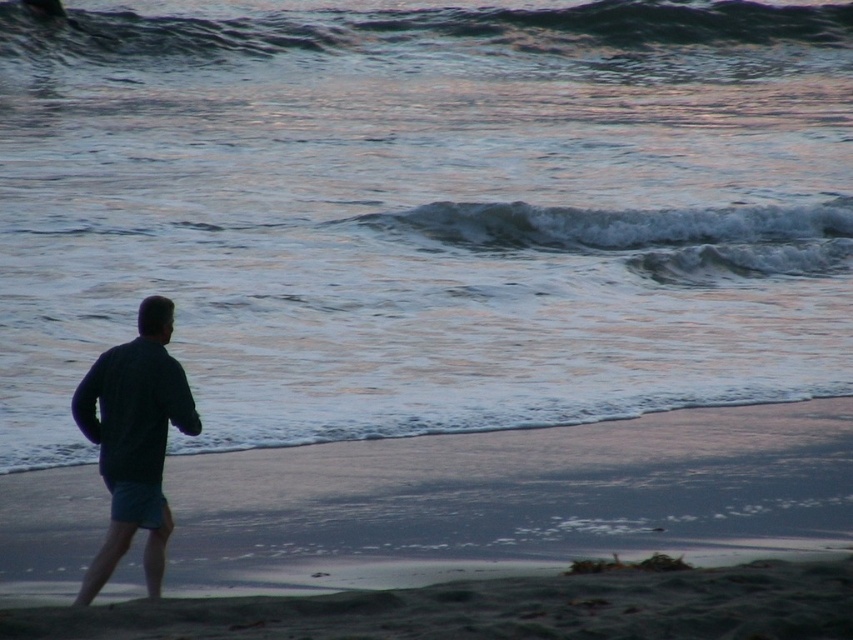
Question: Is dark sand at lower center to the left of dark blue fabric at left from the viewer's perspective?

Choices:
 (A) yes
 (B) no

Answer: (B)

Question: Which of the following is the farthest from the observer?

Choices:
 (A) (74, 400)
 (B) (781, 60)

Answer: (B)

Question: Is shiny blue water at center below white frothy wave at upper center?

Choices:
 (A) yes
 (B) no

Answer: (B)

Question: Which point is closer to the camera?

Choices:
 (A) (471, 216)
 (B) (35, 241)
 (C) (155, 380)
 (D) (381, 515)

Answer: (C)

Question: Which of the following is the farthest from the observer?

Choices:
 (A) (705, 241)
 (B) (105, 460)
 (C) (845, 620)

Answer: (A)

Question: Is dark sand at lower center above dark blue fabric at left?

Choices:
 (A) yes
 (B) no

Answer: (B)